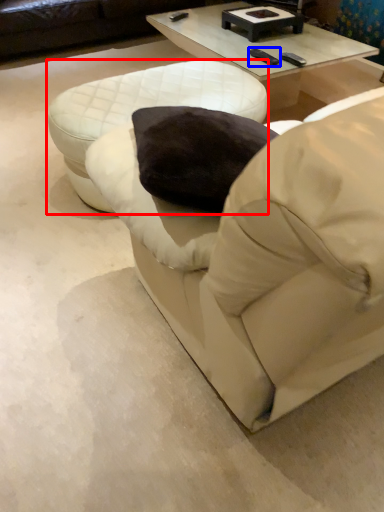
Question: Which object appears closest to the camera in this image, table (highlighted by a red box) or pad (highlighted by a blue box)?

Choices:
 (A) table
 (B) pad

Answer: (A)